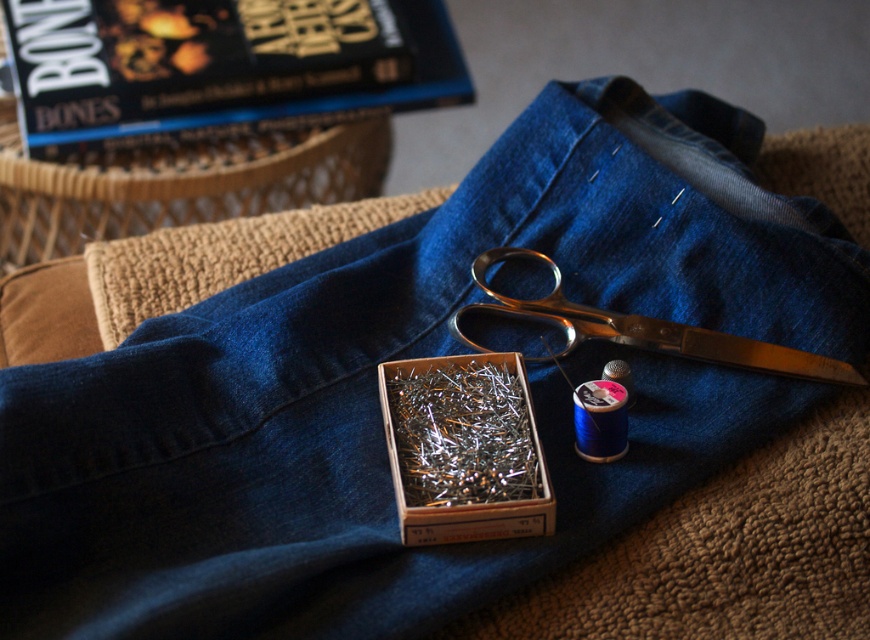
You are organizing a crafting station and need to stack items vertically. Given the wooden box filled with pins at center and the polished metal scissors at center, which item should you place at the bottom to ensure stability?

The wooden box filled with pins at center should be placed at the bottom because it has a greater height than the polished metal scissors at center, providing a stable base.

You are standing in front of the crafting setup and want to place a new sewing kit between the two points, point 1 at [416,474] and point 2 at [523,250]. Which point should the kit be closer to if you want it to be nearer to the foreground?

The sewing kit should be placed closer to point 1 at [416,474] because it is in front of point 2 at [523,250], making it closer to the foreground.

What is the spatial relationship between the wooden box filled with pins at center and the polished metal scissors at center?

The wooden box filled with pins at center is to the left of the polished metal scissors at center.